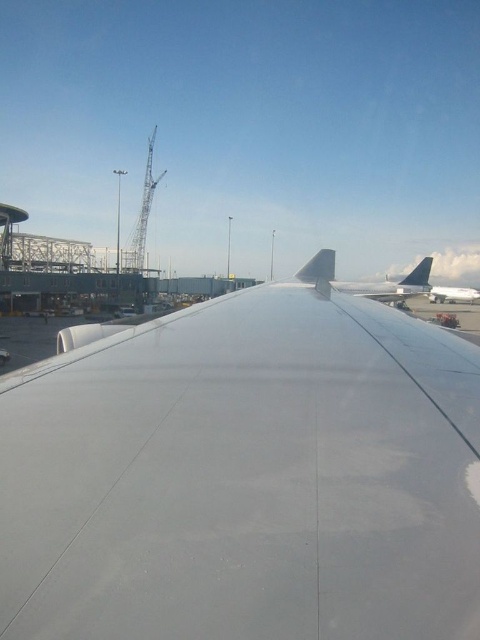
Does metallic silver airplane at center have a lesser height compared to polished aluminum tail at upper right?

In fact, metallic silver airplane at center may be taller than polished aluminum tail at upper right.

Is metallic silver airplane at center closer to camera compared to polished aluminum tail at upper right?

That is True.

Find the location of a particular element. metallic silver airplane at center is located at coordinates (392, 284).

Find the location of `metallic silver airplane at center`. metallic silver airplane at center is located at coordinates (392, 284).

Who is shorter, white matte wing at center or matte white tail at center?

white matte wing at center is shorter.

Is white matte wing at center closer to camera compared to matte white tail at center?

Yes, it is.

Between point (136, 419) and point (331, 260), which one is positioned behind?

Positioned behind is point (331, 260).

Locate an element on the screen. This screenshot has height=640, width=480. white matte wing at center is located at coordinates (244, 476).

Between point (330, 272) and point (412, 278), which one is positioned behind?

The point (412, 278) is behind.

Between matte white tail at center and polished aluminum tail at upper right, which one appears on the left side from the viewer's perspective?

matte white tail at center is more to the left.

This screenshot has width=480, height=640. What do you see at coordinates (319, 268) in the screenshot?
I see `matte white tail at center` at bounding box center [319, 268].

You are a GUI agent. You are given a task and a screenshot of the screen. Output one action in this format:
    pyautogui.click(x=<x>, y=<y>)
    Task: Click on the matte white tail at center
    The image size is (480, 640).
    Given the screenshot: What is the action you would take?
    pyautogui.click(x=319, y=268)